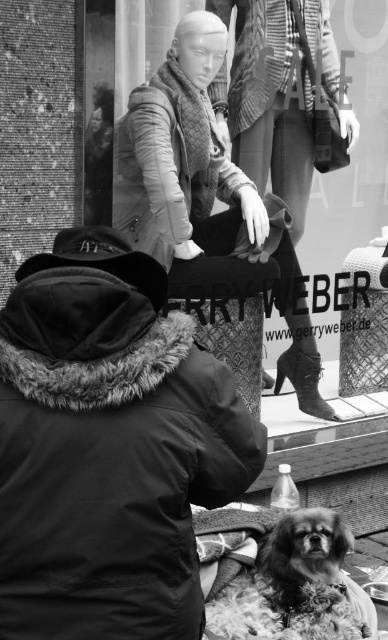
Does matte beige coat at center lie behind fluffy fur dog at lower center?

Yes.

This screenshot has height=640, width=388. What do you see at coordinates (183, 157) in the screenshot?
I see `matte beige coat at center` at bounding box center [183, 157].

Which is behind, point (199, 16) or point (348, 625)?

The point (199, 16) is more distant.

This screenshot has height=640, width=388. I want to click on matte beige coat at center, so (183, 157).